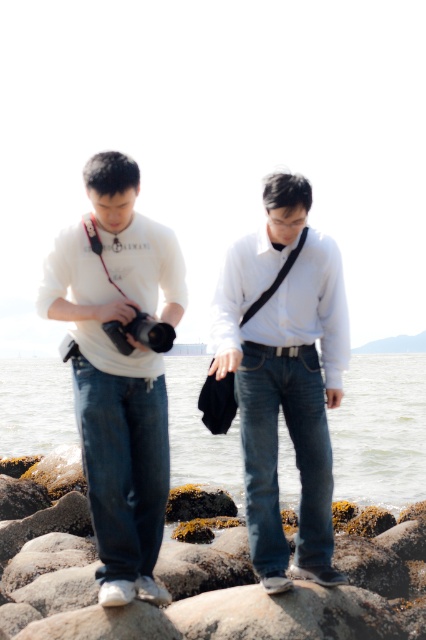
Question: Which point is farther from the camera taking this photo?

Choices:
 (A) (250, 506)
 (B) (118, 346)
 (C) (37, 435)
 (D) (89, 413)

Answer: (C)

Question: Which object is the closest to the denim jeans at center?

Choices:
 (A) matte black camera at left
 (B) clear water at lower center

Answer: (A)

Question: Which point is farther to the camera?

Choices:
 (A) denim jeans at center
 (B) clear water at lower center
 (C) matte black camera at left
 (D) white matte shirt at left

Answer: (B)

Question: Does denim jeans at center have a greater width compared to matte black camera at left?

Choices:
 (A) no
 (B) yes

Answer: (B)

Question: Can you confirm if white matte shirt at center is smaller than clear water at lower center?

Choices:
 (A) no
 (B) yes

Answer: (B)

Question: From the image, what is the correct spatial relationship of denim jeans at center in relation to clear water at lower center?

Choices:
 (A) below
 (B) above

Answer: (B)